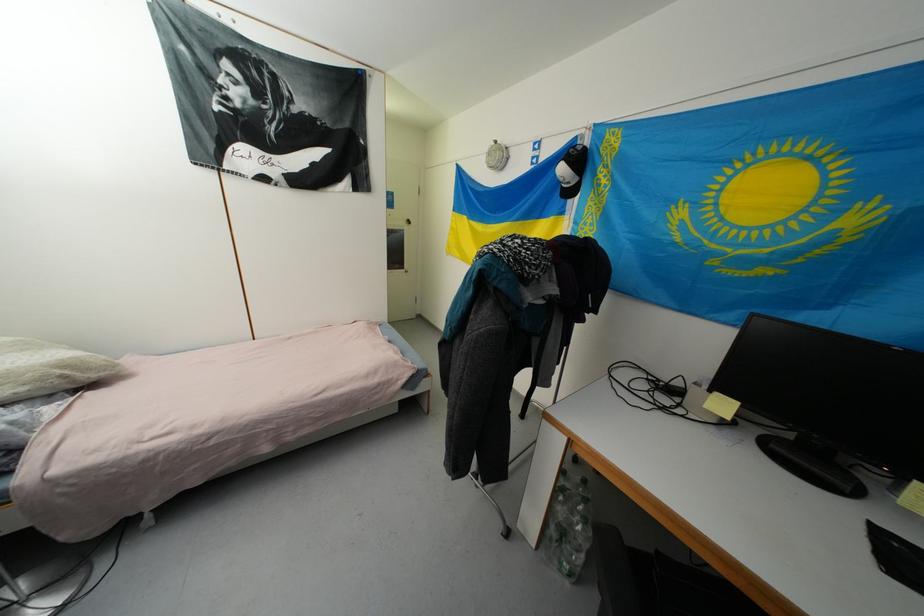
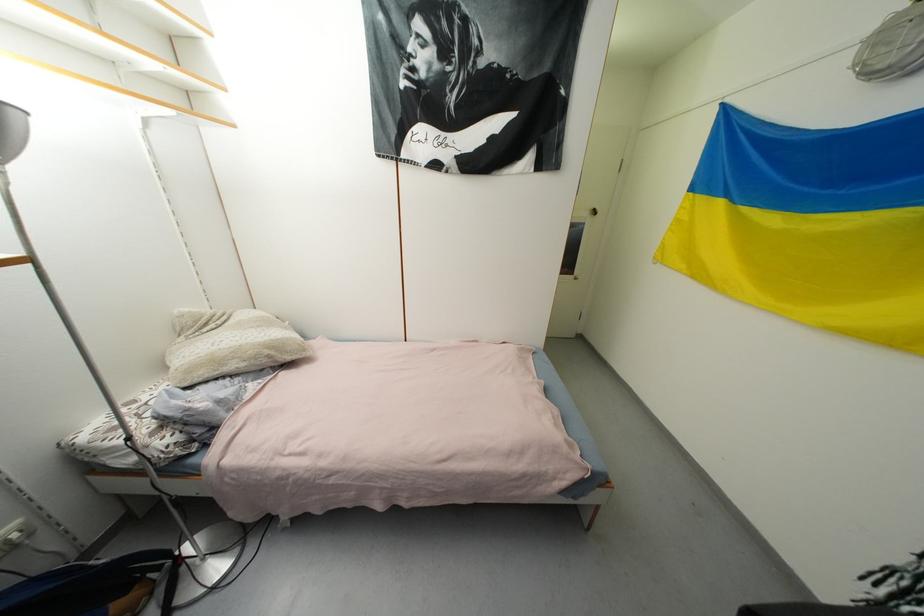
Where in the second image is the point corresponding to pixel 46 381 from the first image?

(261, 359)